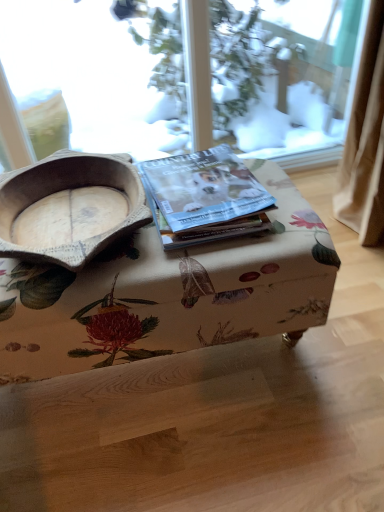
Question: Can you confirm if matte paper magazine at center is taller than wooden bowl at left?

Choices:
 (A) no
 (B) yes

Answer: (A)

Question: Is matte paper magazine at center turned away from wooden bowl at left?

Choices:
 (A) no
 (B) yes

Answer: (A)

Question: From the image's perspective, is matte paper magazine at center beneath wooden bowl at left?

Choices:
 (A) no
 (B) yes

Answer: (A)

Question: Does matte paper magazine at center appear on the left side of wooden bowl at left?

Choices:
 (A) no
 (B) yes

Answer: (A)

Question: Does matte paper magazine at center contain wooden bowl at left?

Choices:
 (A) no
 (B) yes

Answer: (A)

Question: Is matte paper magazine at center far from wooden bowl at left?

Choices:
 (A) no
 (B) yes

Answer: (A)

Question: Considering the relative sizes of matte paper magazine at center and floral fabric ottoman at center in the image provided, is matte paper magazine at center shorter than floral fabric ottoman at center?

Choices:
 (A) yes
 (B) no

Answer: (A)

Question: Considering the relative sizes of matte paper magazine at center and floral fabric ottoman at center in the image provided, is matte paper magazine at center wider than floral fabric ottoman at center?

Choices:
 (A) yes
 (B) no

Answer: (B)

Question: Does matte paper magazine at center have a greater height compared to floral fabric ottoman at center?

Choices:
 (A) yes
 (B) no

Answer: (B)

Question: Does matte paper magazine at center turn towards floral fabric ottoman at center?

Choices:
 (A) no
 (B) yes

Answer: (A)

Question: Is matte paper magazine at center smaller than floral fabric ottoman at center?

Choices:
 (A) no
 (B) yes

Answer: (B)

Question: Is matte paper magazine at center with floral fabric ottoman at center?

Choices:
 (A) yes
 (B) no

Answer: (B)

Question: From the image's perspective, does wooden bowl at left appear lower than floral fabric ottoman at center?

Choices:
 (A) yes
 (B) no

Answer: (B)